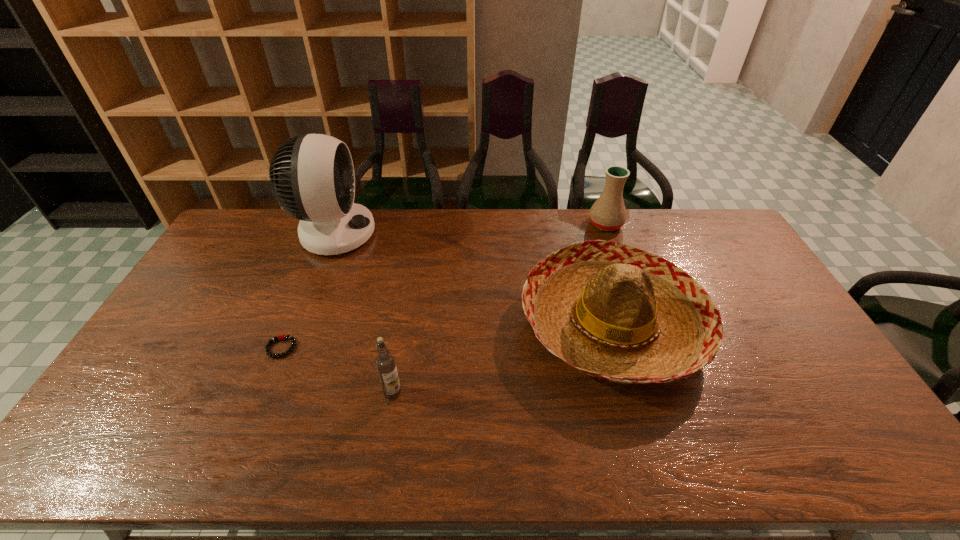
Where is `fan that is at the far edge`? fan that is at the far edge is located at coordinates coord(312,177).

Find the location of a particular element. pottery that is at the far edge is located at coordinates (608, 213).

At what (x,y) coordinates should I click in order to perform the action: click on free region at the far edge. Please return your answer as a coordinate pair (x, y). Image resolution: width=960 pixels, height=540 pixels. Looking at the image, I should click on (584, 223).

In the image, there is a desktop. Find the location of `vacant region at the near edge`. vacant region at the near edge is located at coordinates (618, 444).

Locate an element on the screen. Image resolution: width=960 pixels, height=540 pixels. blank space at the left edge of the desktop is located at coordinates (238, 248).

Identify the location of free region at the right edge of the desktop. (829, 394).

The width and height of the screenshot is (960, 540). I want to click on free location at the far left corner of the desktop, so click(x=227, y=245).

Where is `vacant space at the far right corner of the desktop`? vacant space at the far right corner of the desktop is located at coordinates click(700, 234).

In the image, there is a desktop. In order to click on free space at the near right corner in this screenshot , I will do `click(824, 438)`.

This screenshot has width=960, height=540. Identify the location of free space that is in between the shortest object and the tallest object. (308, 291).